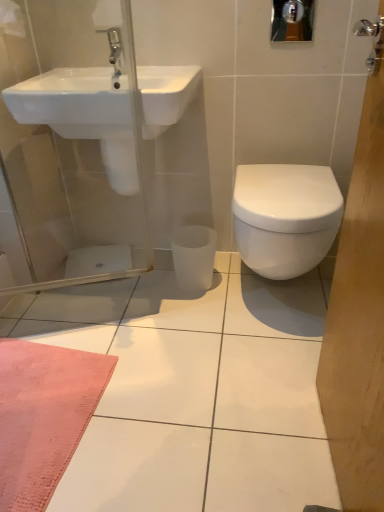
Question: Is white glossy toilet at right closer to camera compared to white glossy sink at upper left?

Choices:
 (A) no
 (B) yes

Answer: (A)

Question: From the image's perspective, does white glossy toilet at right appear higher than white glossy sink at upper left?

Choices:
 (A) yes
 (B) no

Answer: (B)

Question: From a real-world perspective, is white glossy toilet at right physically below white glossy sink at upper left?

Choices:
 (A) yes
 (B) no

Answer: (A)

Question: Is white glossy toilet at right at the left side of white glossy sink at upper left?

Choices:
 (A) yes
 (B) no

Answer: (B)

Question: Is white glossy toilet at right far away from white glossy sink at upper left?

Choices:
 (A) no
 (B) yes

Answer: (A)

Question: Does point (36, 110) appear closer or farther from the camera than point (104, 30)?

Choices:
 (A) farther
 (B) closer

Answer: (A)

Question: From a real-world perspective, is white glossy sink at upper left above or below silver metallic tap at upper left?

Choices:
 (A) below
 (B) above

Answer: (A)

Question: Relative to silver metallic tap at upper left, is white glossy sink at upper left in front or behind?

Choices:
 (A) behind
 (B) front

Answer: (B)

Question: Is white glossy sink at upper left inside the boundaries of silver metallic tap at upper left, or outside?

Choices:
 (A) outside
 (B) inside

Answer: (A)

Question: From a real-world perspective, is silver metallic tap at upper left positioned above or below white glossy sink at upper left?

Choices:
 (A) below
 (B) above

Answer: (B)

Question: From the image's perspective, relative to white glossy sink at upper left, is silver metallic tap at upper left above or below?

Choices:
 (A) below
 (B) above

Answer: (B)

Question: Is point (117, 35) positioned closer to the camera than point (177, 103)?

Choices:
 (A) closer
 (B) farther

Answer: (A)

Question: Is silver metallic tap at upper left inside or outside of white glossy sink at upper left?

Choices:
 (A) outside
 (B) inside

Answer: (A)

Question: Based on their sizes in the image, would you say silver metallic tap at upper left is bigger or smaller than white glossy toilet at right?

Choices:
 (A) big
 (B) small

Answer: (B)

Question: From the image's perspective, is silver metallic tap at upper left above or below white glossy toilet at right?

Choices:
 (A) above
 (B) below

Answer: (A)